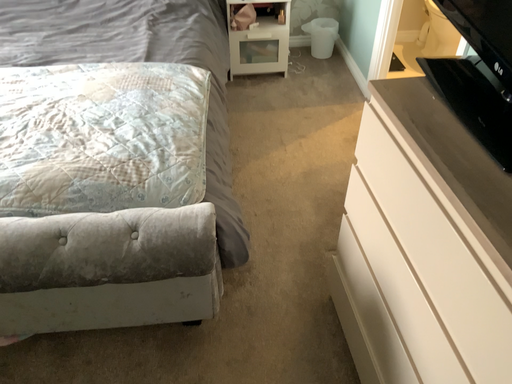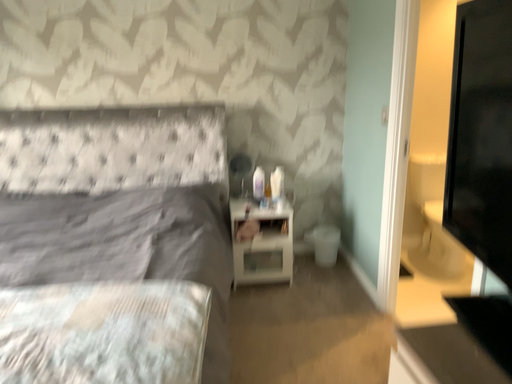
Question: How did the camera likely rotate when shooting the video?

Choices:
 (A) rotated downward
 (B) rotated upward

Answer: (B)